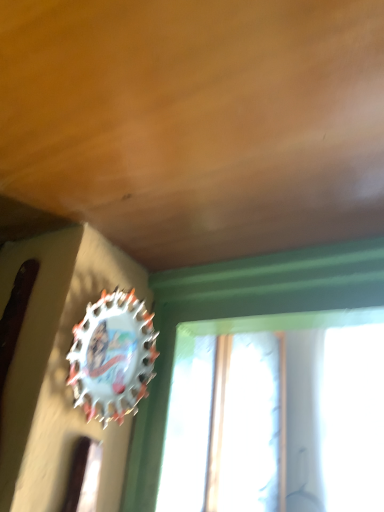
Measure the distance between point (113,391) and camera.

The distance of point (113,391) from camera is 22.20 inches.

This screenshot has width=384, height=512. In order to click on metallic painted clock at lower left in this screenshot , I will do `click(112, 357)`.

The height and width of the screenshot is (512, 384). What do you see at coordinates (112, 357) in the screenshot? I see `metallic painted clock at lower left` at bounding box center [112, 357].

Locate an element on the screen. This screenshot has height=512, width=384. metallic painted clock at lower left is located at coordinates (112, 357).